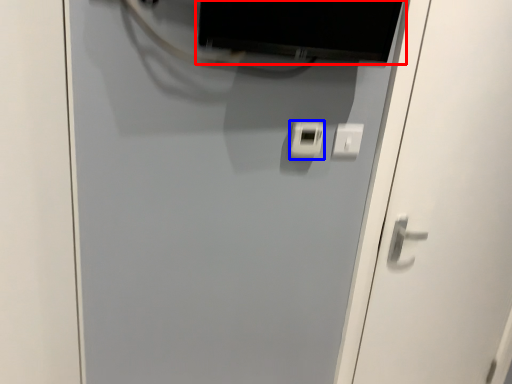
Question: Which object is further to the camera taking this photo, computer monitor (highlighted by a red box) or light switch (highlighted by a blue box)?

Choices:
 (A) computer monitor
 (B) light switch

Answer: (B)